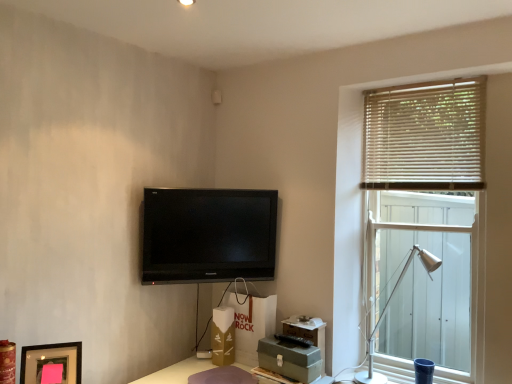
Question: In terms of width, does wooden blinds at right look wider or thinner when compared to beige wooden blinds at upper right?

Choices:
 (A) thin
 (B) wide

Answer: (B)

Question: Relative to beige wooden blinds at upper right, is wooden blinds at right in front or behind?

Choices:
 (A) behind
 (B) front

Answer: (B)

Question: Which object is positioned farthest from the black glossy tv at upper center?

Choices:
 (A) matte brown table at lower center
 (B) wooden blinds at right
 (C) matte black picture frame at lower left
 (D) beige wooden blinds at upper right
 (E) silver metallic table lamp at right

Answer: (E)

Question: Which object is the farthest from the black glossy tv at upper center?

Choices:
 (A) silver metallic table lamp at right
 (B) wooden blinds at right
 (C) beige wooden blinds at upper right
 (D) matte brown table at lower center
 (E) matte black picture frame at lower left

Answer: (A)